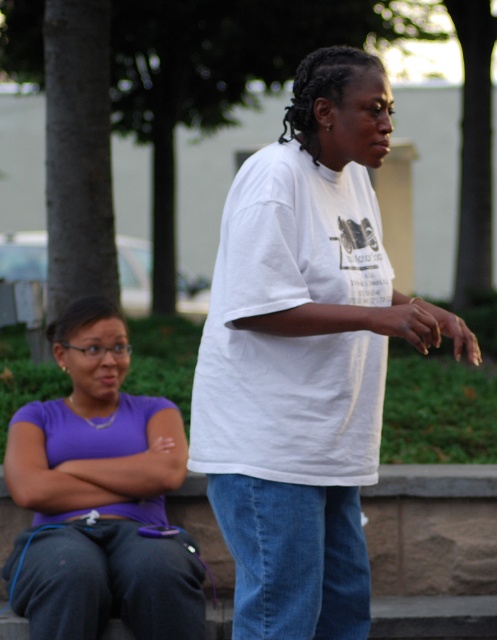
You are a photographer standing 2 meters away from the two people in the scene. You want to take a photo of both the white cotton shirt at center and the purple matte shirt at center in the same frame. Will you be able to capture both shirts in the photo if your camera has a 1.5 meter field of view?

The white cotton shirt at center is 1.66 meters from the purple matte shirt at center. Since the distance between them is slightly longer than the camera field of view, you might need to adjust your position to ensure both shirts fit within the 1.5 meter field of view.

You are a photographer trying to capture a candid shot of both the white cotton shirt at center and the purple matte shirt at center. Since you want to frame them in a way that highlights their positions relative to each other, which shirt should you position on the left side of your camera frame?

The purple matte shirt at center should be positioned on the left side of your camera frame because the white cotton shirt at center is to the right of it.

You are standing in front of the two people in the image. Which person, the white cotton shirt at center or the purple matte shirt at center, is closer to you?

The white cotton shirt at center is closer to the viewer than the purple matte shirt at center.